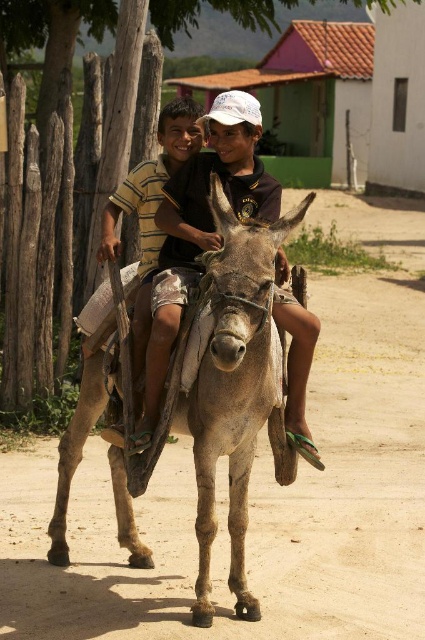
Question: Which point is farther to the camera?

Choices:
 (A) matte brown donkey at center
 (B) striped cotton shirt at center

Answer: (B)

Question: Where is gray rough mule at center located in relation to matte brown donkey at center in the image?

Choices:
 (A) left
 (B) right

Answer: (B)

Question: Does gray rough mule at center appear under striped cotton shirt at center?

Choices:
 (A) no
 (B) yes

Answer: (B)

Question: Considering the real-world distances, which object is closest to the gray rough mule at center?

Choices:
 (A) striped cotton shirt at center
 (B) matte brown donkey at center

Answer: (B)

Question: Is gray rough mule at center positioned in front of striped cotton shirt at center?

Choices:
 (A) no
 (B) yes

Answer: (B)

Question: Which is nearer to the striped cotton shirt at center?

Choices:
 (A) gray rough mule at center
 (B) matte brown donkey at center

Answer: (B)